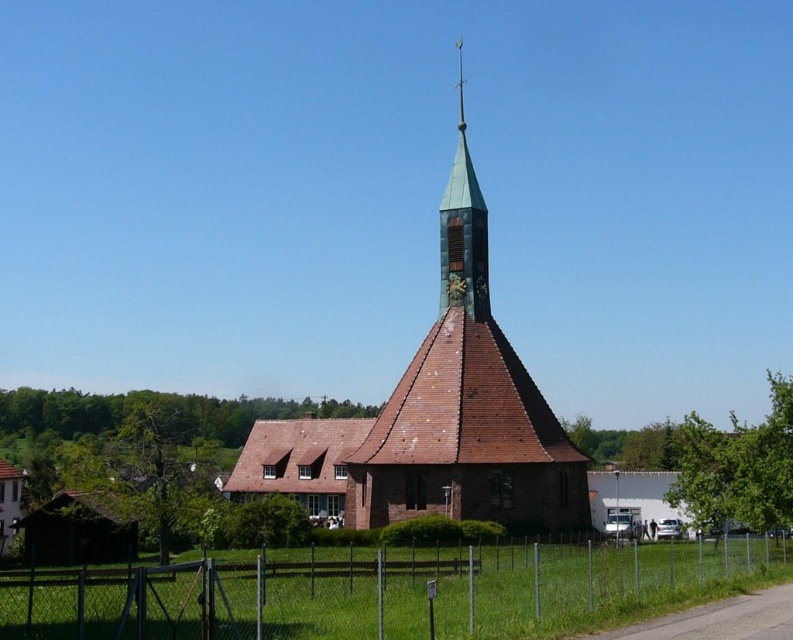
Question: Can you confirm if metallic chain-link fence at lower center is bigger than brown brick church at center?

Choices:
 (A) no
 (B) yes

Answer: (A)

Question: Is metallic chain-link fence at lower center to the right of brown brick church at center from the viewer's perspective?

Choices:
 (A) no
 (B) yes

Answer: (B)

Question: Which of the following is the farthest from the observer?

Choices:
 (A) brown brick church at center
 (B) metallic chain-link fence at lower center

Answer: (A)

Question: Does metallic chain-link fence at lower center have a lesser width compared to brown brick church at center?

Choices:
 (A) no
 (B) yes

Answer: (A)

Question: Which point is farther from the camera taking this photo?

Choices:
 (A) (170, 564)
 (B) (391, 499)

Answer: (B)